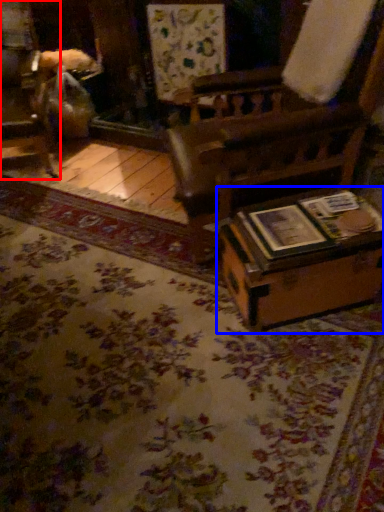
Question: Which of the following is the farthest to the observer, furniture (highlighted by a red box) or table (highlighted by a blue box)?

Choices:
 (A) furniture
 (B) table

Answer: (A)